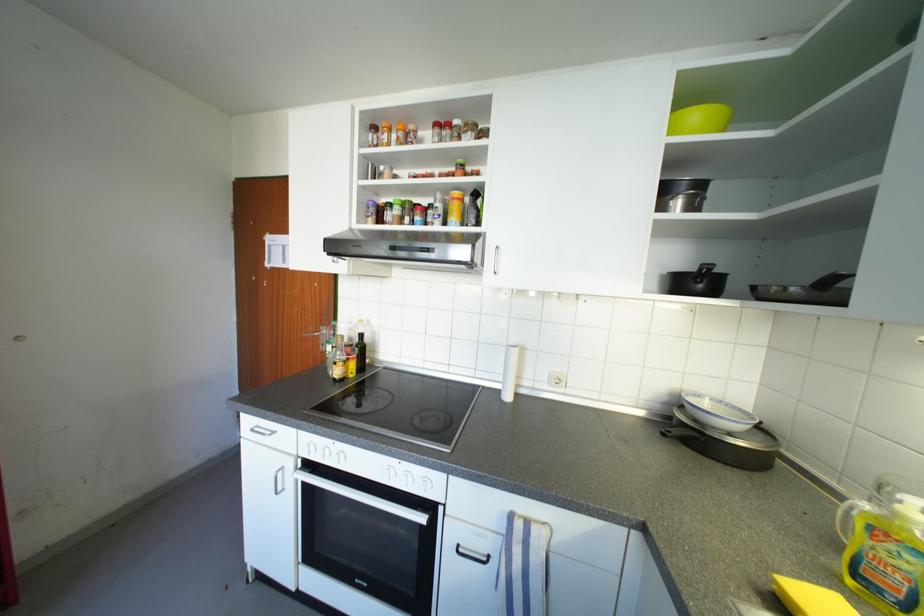
What do you see at coordinates (703, 272) in the screenshot? The width and height of the screenshot is (924, 616). I see `a black pot handle` at bounding box center [703, 272].